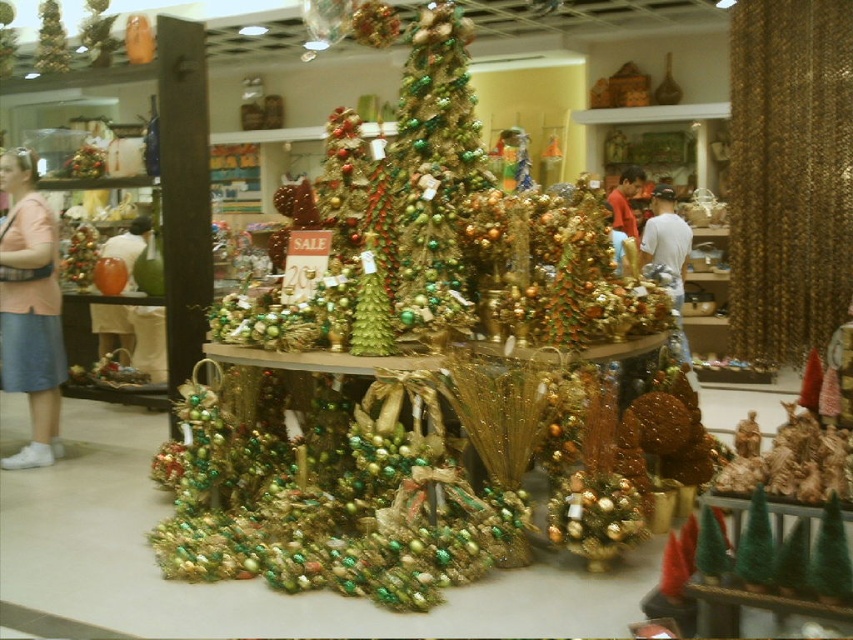
Can you confirm if green metallic christmas tree at center is positioned above pink fabric skirt at left?

Indeed, green metallic christmas tree at center is positioned over pink fabric skirt at left.

Which is in front, point (422, 333) or point (33, 225)?

Positioned in front is point (422, 333).

Which is behind, point (415, 49) or point (45, 317)?

Positioned behind is point (45, 317).

Find the location of a particular element. green metallic christmas tree at center is located at coordinates (434, 173).

Can you confirm if pink fabric skirt at left is shorter than matte white vase at left?

Incorrect, pink fabric skirt at left's height does not fall short of matte white vase at left's.

This screenshot has height=640, width=853. Identify the location of pink fabric skirt at left. (30, 308).

The width and height of the screenshot is (853, 640). In order to click on pink fabric skirt at left in this screenshot , I will do `click(30, 308)`.

Does pink fabric skirt at left appear over matte red sweater at center?

No, pink fabric skirt at left is not above matte red sweater at center.

Image resolution: width=853 pixels, height=640 pixels. What do you see at coordinates (30, 308) in the screenshot?
I see `pink fabric skirt at left` at bounding box center [30, 308].

Describe the element at coordinates (30, 308) in the screenshot. I see `pink fabric skirt at left` at that location.

The width and height of the screenshot is (853, 640). Identify the location of pink fabric skirt at left. [x=30, y=308].